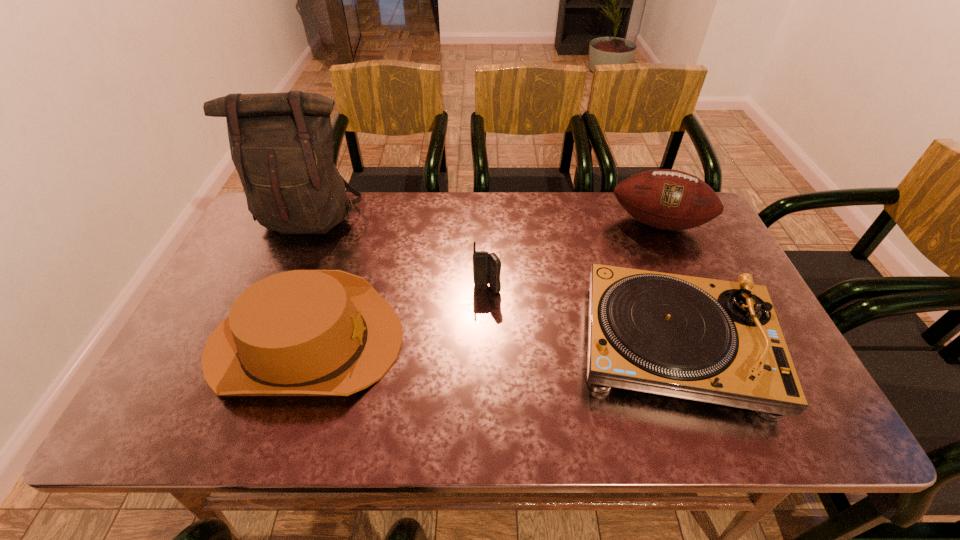
The height and width of the screenshot is (540, 960). I want to click on free space that satisfies the following two spatial constraints: 1. on the open flap of the tallest object; 2. on the left side of the football (American), so click(307, 223).

At what (x,y) coordinates should I click in order to perform the action: click on vacant region that satisfies the following two spatial constraints: 1. on the keyboard of the cellular telephone; 2. on the front-facing side of the cowboy hat. Please return your answer as a coordinate pair (x, y). The image size is (960, 540). Looking at the image, I should click on (488, 342).

Find the location of a particular element. The image size is (960, 540). free space in the image that satisfies the following two spatial constraints: 1. on the open flap of the record player; 2. on the right side of the backpack is located at coordinates (255, 346).